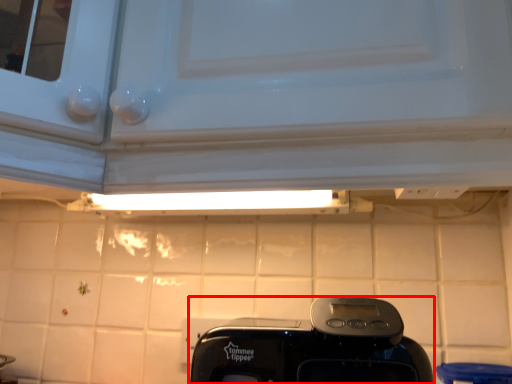
Question: From the image's perspective, what is the correct spatial relationship of home appliance (annotated by the red box) in relation to tile?

Choices:
 (A) below
 (B) above

Answer: (B)